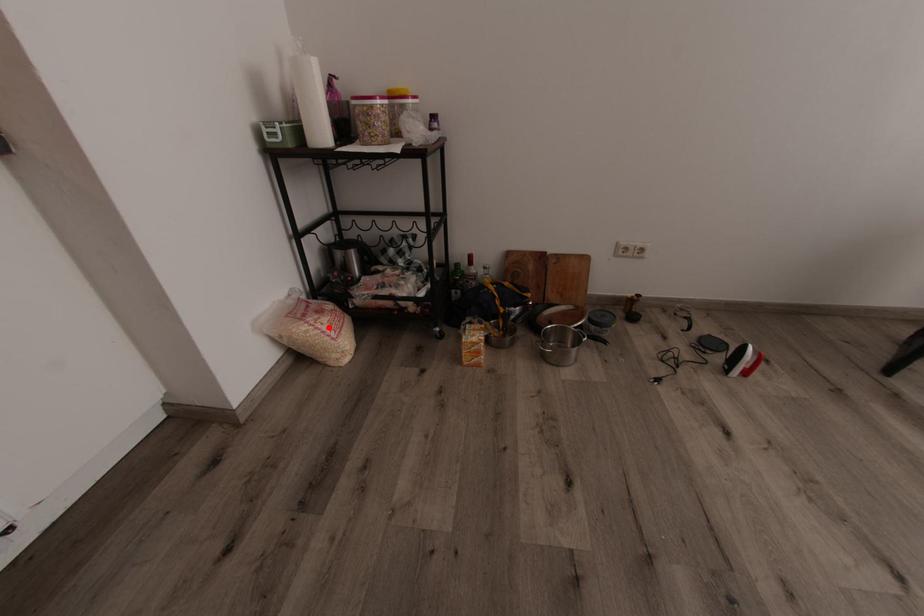
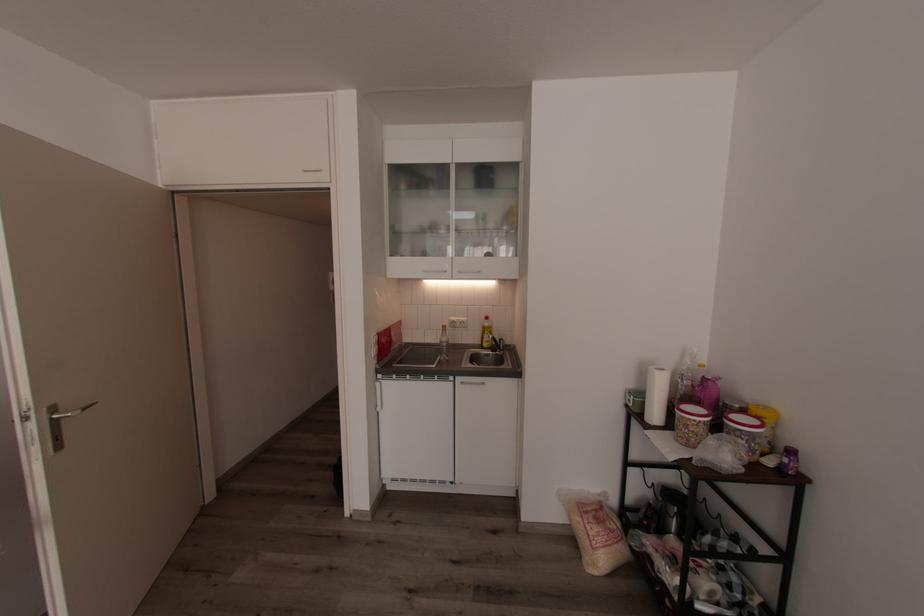
Locate, in the second image, the point that corresponds to the highlighted location in the first image.

(594, 533)